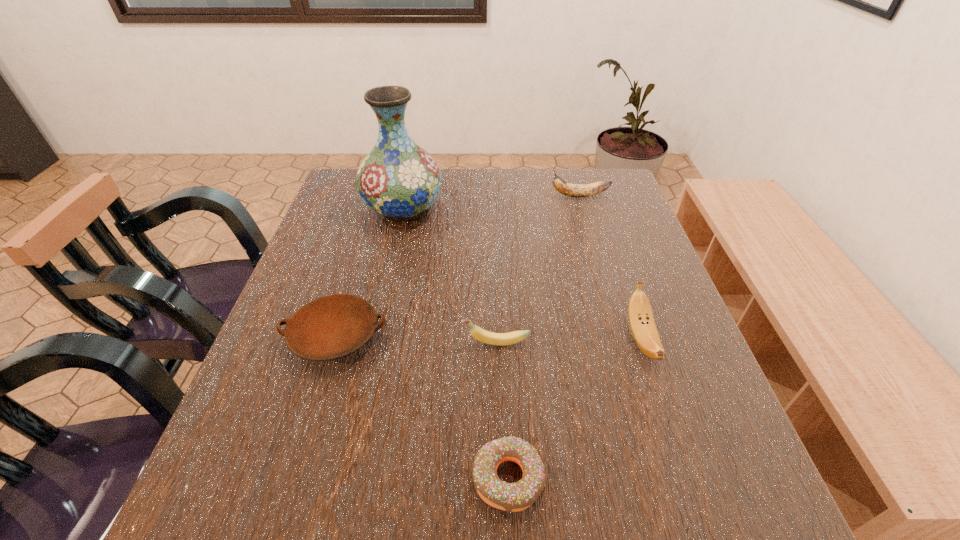
Locate an element on the screen. The image size is (960, 540). free location located at the stem of the leftmost banana is located at coordinates (427, 342).

Locate an element on the screen. vacant space located 0.270m at the stem of the leftmost banana is located at coordinates (328, 342).

In order to click on free space located 0.270m at the stem of the leftmost banana in this screenshot , I will do `click(328, 342)`.

Where is `vacant space located 0.120m on the back of the plate`? vacant space located 0.120m on the back of the plate is located at coordinates (356, 268).

Locate an element on the screen. vacant space located on the back of the doughnut is located at coordinates (503, 366).

This screenshot has width=960, height=540. I want to click on vase that is at the far edge, so click(x=398, y=179).

This screenshot has height=540, width=960. I want to click on banana positioned at the far edge, so click(x=573, y=190).

Image resolution: width=960 pixels, height=540 pixels. I want to click on object that is at the near edge, so click(x=512, y=497).

This screenshot has width=960, height=540. Identify the location of vase positioned at the left edge. pyautogui.click(x=398, y=179).

This screenshot has width=960, height=540. Identify the location of plate that is at the left edge. (330, 327).